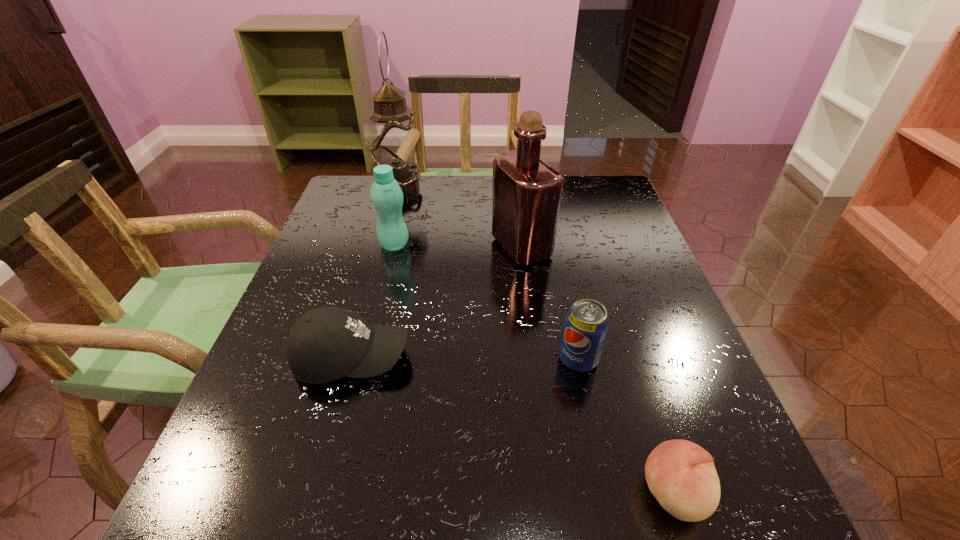
The image size is (960, 540). Identify the location of object that is at the far left corner. (394, 141).

Locate an element on the screen. This screenshot has height=540, width=960. object situated at the near right corner is located at coordinates (681, 475).

Locate an element on the screen. vacant space at the near edge of the desktop is located at coordinates coord(625,479).

This screenshot has height=540, width=960. I want to click on vacant space at the left edge, so click(350, 309).

This screenshot has height=540, width=960. What are the coordinates of `free region at the right edge of the desktop` in the screenshot? It's located at pyautogui.click(x=588, y=243).

In the image, there is a desktop. Identify the location of free space at the far left corner. The height and width of the screenshot is (540, 960). (362, 190).

Find the location of a particular element. This screenshot has height=540, width=960. vacant space that's between the rightmost object and the liquor is located at coordinates [597, 370].

This screenshot has width=960, height=540. In order to click on free area in between the third tallest object and the baseball cap in this screenshot , I will do `click(372, 301)`.

At what (x,y) coordinates should I click in order to perform the action: click on vacant space that's between the second shortest object and the farthest object. Please return your answer as a coordinate pair (x, y). Looking at the image, I should click on (375, 273).

Find the location of `empty space between the soda and the rightmost object`. empty space between the soda and the rightmost object is located at coordinates (626, 426).